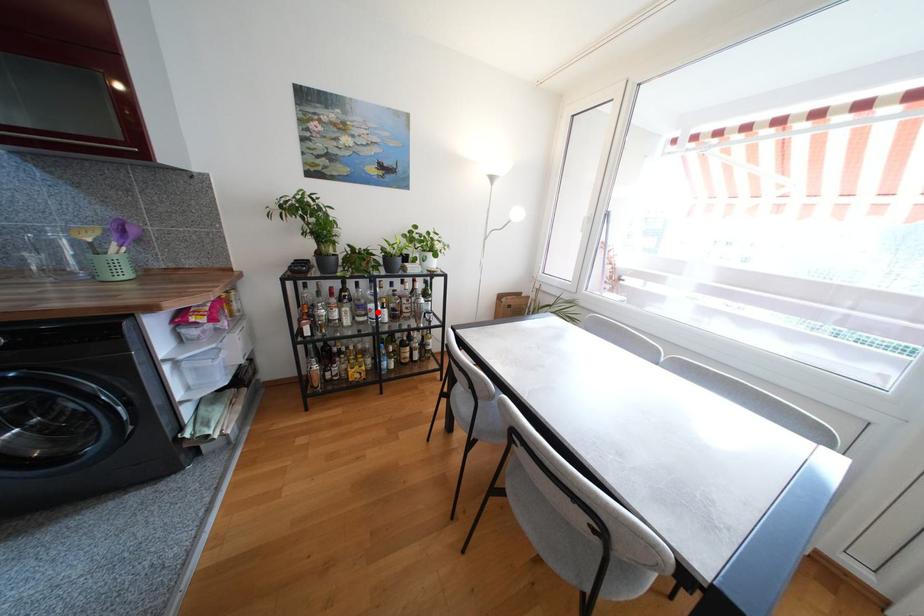
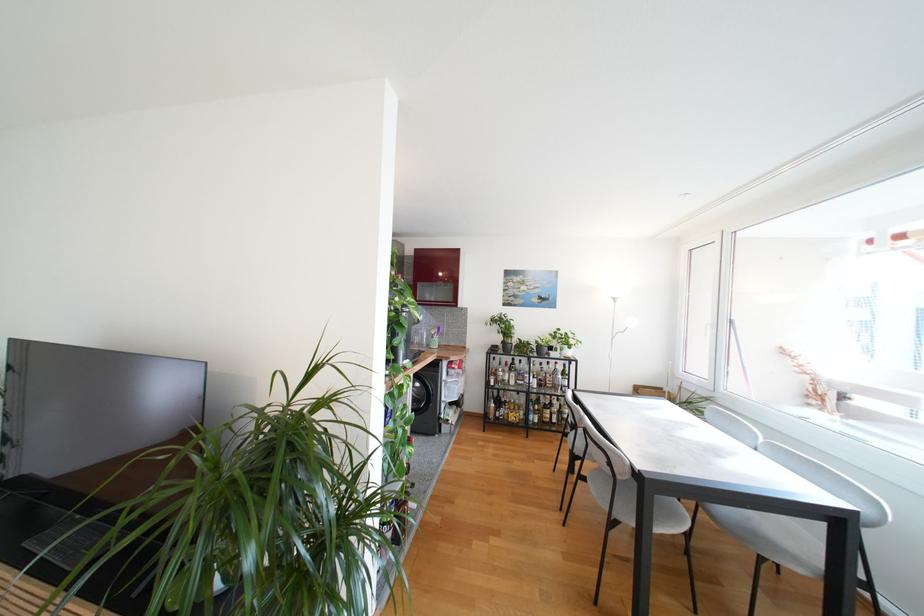
Question: A red point is marked in image1. In image2, is the corresponding 3D point closer to the camera or farther? Reply with the corresponding letter.

Choices:
 (A) The corresponding 3D point is closer.
 (B) The corresponding 3D point is farther.

Answer: (B)